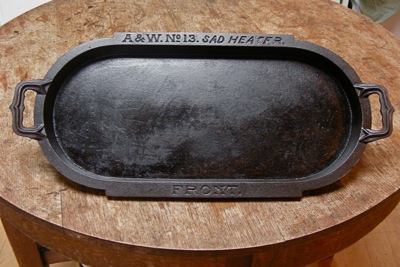
Locate an element on the screen. The width and height of the screenshot is (400, 267). sad heater is located at coordinates (203, 39).